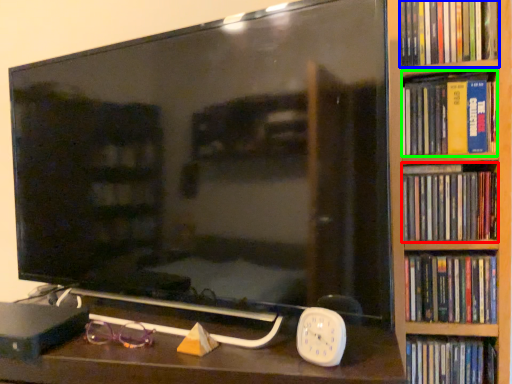
Question: Which is farther away from book (highlighted by a red box)? book (highlighted by a blue box) or book (highlighted by a green box)?

Choices:
 (A) book
 (B) book

Answer: (A)